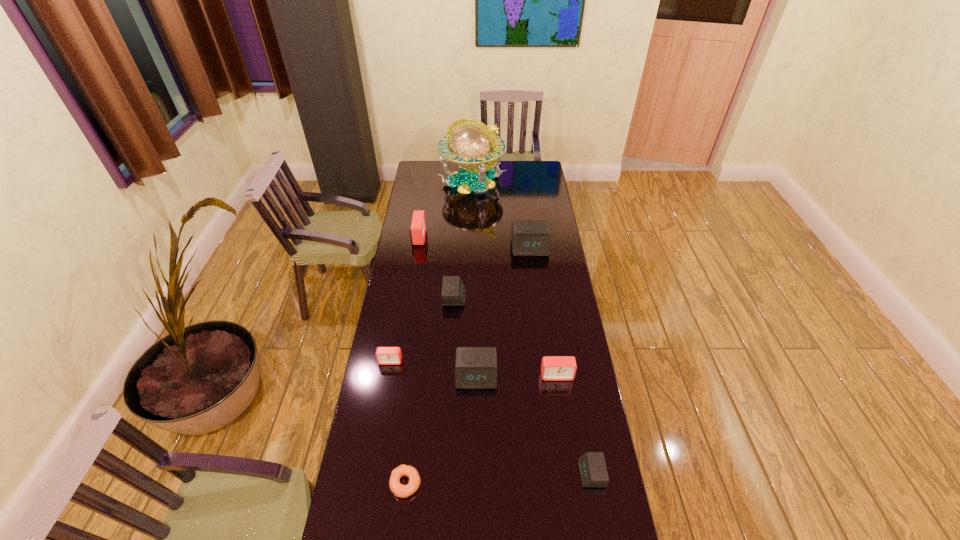
Image resolution: width=960 pixels, height=540 pixels. I want to click on blank area in the image that satisfies the following two spatial constraints: 1. on the front-facing side of the farthest black alarm clock; 2. on the front-facing side of the third farthest alarm clock, so click(x=536, y=297).